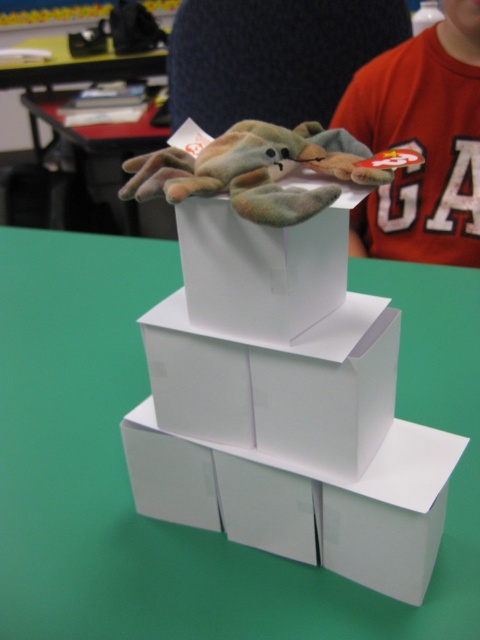
Question: Is red cotton shirt at upper center to the left of white matte box at center from the viewer's perspective?

Choices:
 (A) no
 (B) yes

Answer: (A)

Question: Observing the image, what is the correct spatial positioning of white cardboard boxes at center in reference to green plush toy at center?

Choices:
 (A) right
 (B) left

Answer: (B)

Question: Observing the image, what is the correct spatial positioning of white cardboard boxes at center in reference to red cotton shirt at upper center?

Choices:
 (A) below
 (B) above

Answer: (A)

Question: Among these objects, which one is farthest from the camera?

Choices:
 (A) red cotton shirt at upper center
 (B) white cardboard boxes at center
 (C) green plush toy at center

Answer: (A)

Question: Estimate the real-world distances between objects in this image. Which object is farther from the red cotton shirt at upper center?

Choices:
 (A) white matte box at center
 (B) green plush toy at center

Answer: (A)

Question: Based on their relative distances, which object is nearer to the white matte box at center?

Choices:
 (A) green plush toy at center
 (B) red cotton shirt at upper center

Answer: (A)